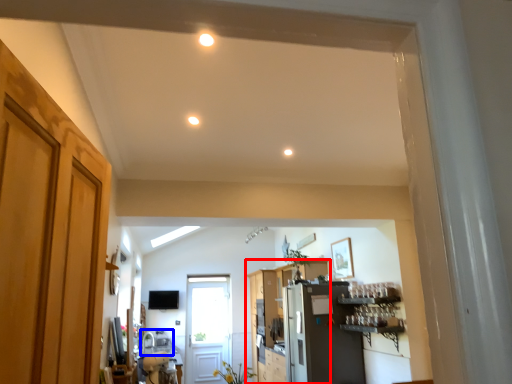
Question: Which object appears closest to the camera in this image, cabinetry (highlighted by a red box) or sink (highlighted by a blue box)?

Choices:
 (A) cabinetry
 (B) sink

Answer: (B)